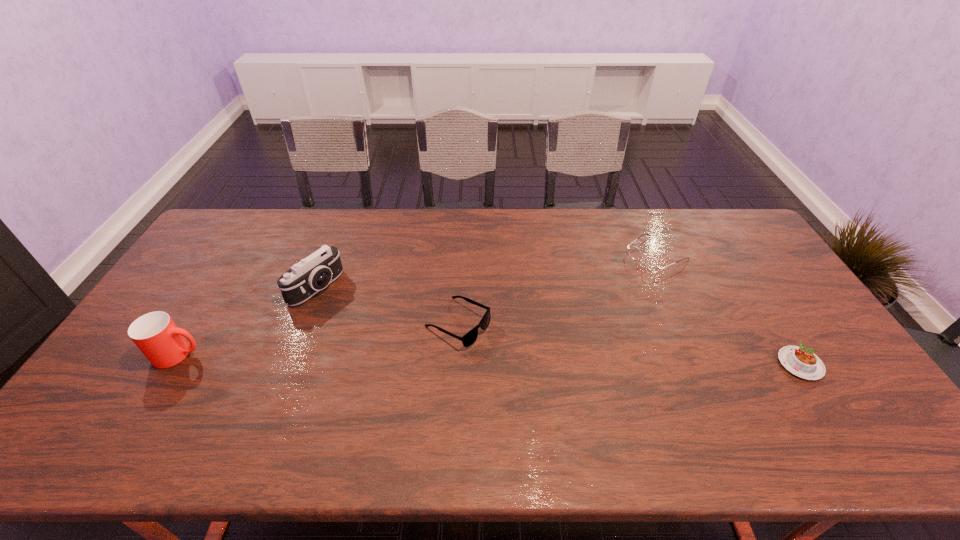
In the image, there is a desktop. At what (x,y) coordinates should I click in order to perform the action: click on blank space at the far edge. Please return your answer as a coordinate pair (x, y). Image resolution: width=960 pixels, height=540 pixels. Looking at the image, I should click on (314, 208).

Identify the location of vacant space at the near edge. (286, 400).

In order to click on vacant region at the right edge in this screenshot , I will do `click(740, 267)`.

Locate an element on the screen. free space at the near left corner of the desktop is located at coordinates (84, 408).

Identify the location of free spot at the near right corner of the desktop. (815, 400).

Identify the location of free space between the sunglasses and the spectacles. (557, 289).

Image resolution: width=960 pixels, height=540 pixels. In order to click on vacant region between the sunglasses and the spectacles in this screenshot , I will do `click(557, 289)`.

Locate an element on the screen. Image resolution: width=960 pixels, height=540 pixels. free spot between the fourth object from left to right and the third object from left to right is located at coordinates (557, 289).

The height and width of the screenshot is (540, 960). I want to click on empty space between the fourth object from right to left and the third object from left to right, so click(387, 306).

Where is `free spot between the fourth object from right to left and the shortest object`? Image resolution: width=960 pixels, height=540 pixels. free spot between the fourth object from right to left and the shortest object is located at coordinates (558, 326).